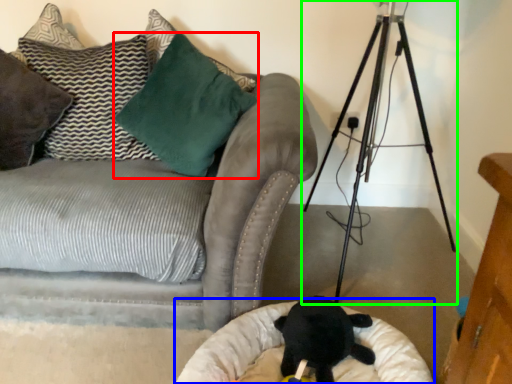
Question: Which object is positioned closest to pillow (highlighted by a red box)? Select from cat bed (highlighted by a blue box) and tripod (highlighted by a green box).

Choices:
 (A) cat bed
 (B) tripod

Answer: (B)